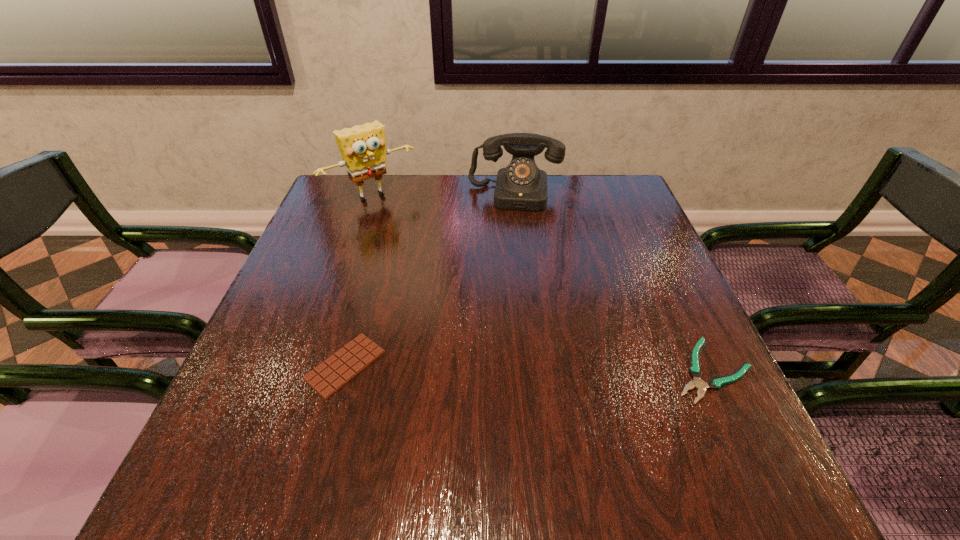
The height and width of the screenshot is (540, 960). Find the location of `vacant space located on the face of the tallest object`. vacant space located on the face of the tallest object is located at coordinates point(431,251).

Find the location of a particular element. The height and width of the screenshot is (540, 960). free location located on the face of the tallest object is located at coordinates (431, 251).

Where is `vacant region located on the face of the tallest object`? vacant region located on the face of the tallest object is located at coordinates (457, 278).

This screenshot has height=540, width=960. Identify the location of telephone at the far edge. (521, 185).

Locate an element on the screen. sponge at the far edge is located at coordinates (362, 147).

Find the location of a particular element. candy bar positioned at the near edge is located at coordinates [x=334, y=373].

Identify the location of pliers at the near edge. The image size is (960, 540). pyautogui.click(x=695, y=371).

At what (x,y) coordinates should I click in order to perform the action: click on candy bar located in the left edge section of the desktop. Please return your answer as a coordinate pair (x, y). The image size is (960, 540). Looking at the image, I should click on (334, 373).

The height and width of the screenshot is (540, 960). Identify the location of sponge located at the left edge. (362, 147).

The image size is (960, 540). I want to click on object that is at the right edge, so click(x=695, y=371).